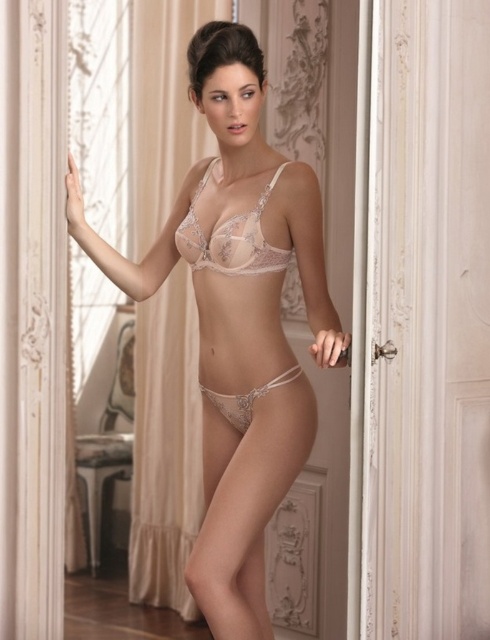
What do you see at coordinates (230, 237) in the screenshot? This screenshot has height=640, width=490. I see `translucent lace bikini at center` at bounding box center [230, 237].

Is translucent lace bikini at center shorter than translucent lace bikini top at center?

Yes.

Is point (249, 273) behind point (274, 268)?

No, it is in front of (274, 268).

In order to click on translucent lace bikini at center in this screenshot , I will do `click(230, 237)`.

Can you confirm if translucent lace lingerie at center is thinner than translucent lace bikini at center?

No.

Which of these two, translucent lace lingerie at center or translucent lace bikini at center, stands taller?

translucent lace lingerie at center

What are the coordinates of `translucent lace lingerie at center` in the screenshot? It's located at pyautogui.click(x=238, y=320).

Between translucent lace lingerie at center and translucent lace bikini top at center, which one has more height?

Standing taller between the two is translucent lace lingerie at center.

Can you confirm if translucent lace lingerie at center is positioned to the right of translucent lace bikini top at center?

No, translucent lace lingerie at center is not to the right of translucent lace bikini top at center.

Who is more forward, (277, 348) or (196, 259)?

Point (196, 259)

Image resolution: width=490 pixels, height=640 pixels. Find the location of `translucent lace lingerie at center`. translucent lace lingerie at center is located at coordinates (238, 320).